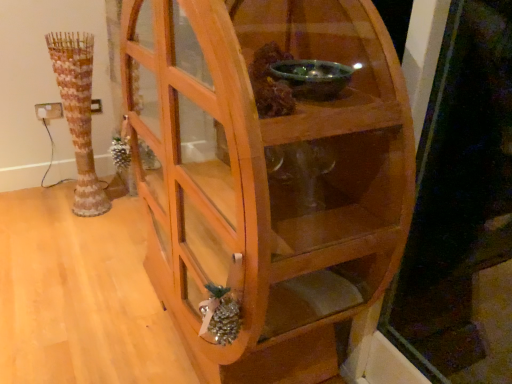
Find the location of a particular element. vacant area that lies to the right of wooden textured vase at left is located at coordinates (119, 220).